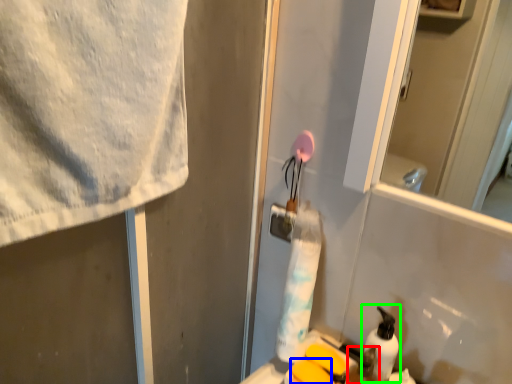
Question: Which is nearer to the toiletry (highlighted by a red box)? soap (highlighted by a blue box) or cleaning product (highlighted by a green box).

Choices:
 (A) soap
 (B) cleaning product

Answer: (B)